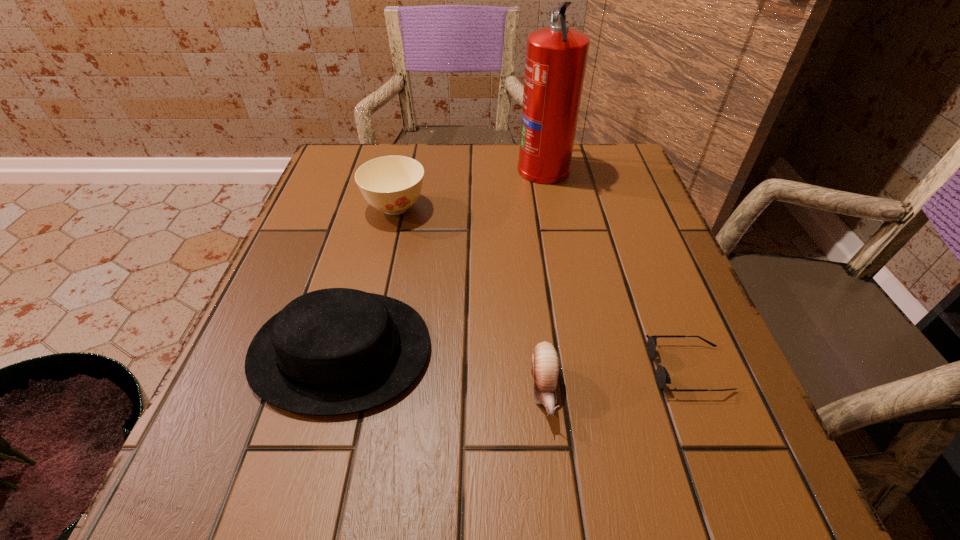
At what (x,y) coordinates should I click in order to perform the action: click on the farthest object. Please return your answer as a coordinate pair (x, y). Image resolution: width=960 pixels, height=540 pixels. Looking at the image, I should click on (556, 56).

The width and height of the screenshot is (960, 540). Find the location of `the tallest object`. the tallest object is located at coordinates (556, 56).

You are a GUI agent. You are given a task and a screenshot of the screen. Output one action in this format:
    pyautogui.click(x=<x>, y=<y>)
    Task: Click on the fourth nearest object
    Image resolution: width=960 pixels, height=540 pixels.
    Given the screenshot: What is the action you would take?
    pyautogui.click(x=392, y=184)

In order to click on fedora in this screenshot , I will do `click(334, 351)`.

Where is `escargot`? The height and width of the screenshot is (540, 960). escargot is located at coordinates (545, 362).

You are a GUI agent. You are given a task and a screenshot of the screen. Output one action in this format:
    pyautogui.click(x=<x>, y=<y>)
    Task: Click on the sunglasses
    
    Given the screenshot: What is the action you would take?
    pyautogui.click(x=662, y=376)

Find the location of `the shortest object`. the shortest object is located at coordinates (662, 376).

Find the location of a particular element. This screenshot has width=960, height=540. vacant space located on the instruction side of the farthest object is located at coordinates (455, 168).

Find the location of a particular element. The width and height of the screenshot is (960, 540). vacant space situated 0.280m on the instruction side of the farthest object is located at coordinates (408, 168).

This screenshot has width=960, height=540. I want to click on vacant space located 0.180m on the instruction side of the farthest object, so click(447, 168).